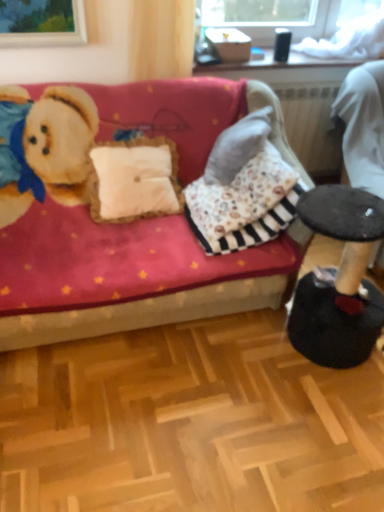
Where is `velvet red couch at center`? The image size is (384, 512). velvet red couch at center is located at coordinates (144, 312).

What do you see at coordinates (144, 312) in the screenshot? I see `velvet red couch at center` at bounding box center [144, 312].

What is the approximate height of velvet red couch at center?

velvet red couch at center is 35.06 inches tall.

Measure the distance between dark brown leather swivel chair at right and camera.

They are 2.07 meters apart.

You are a GUI agent. You are given a task and a screenshot of the screen. Output one action in this format:
    pyautogui.click(x=<x>, y=<y>)
    Task: Click on the dark brown leather swivel chair at right
    This screenshot has height=512, width=384.
    Given the screenshot: What is the action you would take?
    pyautogui.click(x=363, y=125)

What is the approximate height of dark brown leather swivel chair at right?

dark brown leather swivel chair at right is 36.82 inches in height.

The height and width of the screenshot is (512, 384). What do you see at coordinates (363, 125) in the screenshot? I see `dark brown leather swivel chair at right` at bounding box center [363, 125].

You are a GUI agent. You are given a task and a screenshot of the screen. Output one action in this format:
    pyautogui.click(x=<x>, y=<y>)
    Task: Click on the velvet red couch at center
    
    Given the screenshot: What is the action you would take?
    pyautogui.click(x=144, y=312)

Between dark brown leather swivel chair at right and velvet red couch at center, which one appears on the left side from the viewer's perspective?

Positioned to the left is velvet red couch at center.

Considering the positions of objects dark brown leather swivel chair at right and velvet red couch at center in the image provided, who is behind, dark brown leather swivel chair at right or velvet red couch at center?

Positioned behind is dark brown leather swivel chair at right.

Does point (351, 139) appear closer or farther from the camera than point (105, 333)?

Point (351, 139).

From the image's perspective, is dark brown leather swivel chair at right located above or below velvet red couch at center?

Clearly, from the image's perspective, dark brown leather swivel chair at right is above velvet red couch at center.

From a real-world perspective, which is physically above, dark brown leather swivel chair at right or velvet red couch at center?

From a 3D spatial view, dark brown leather swivel chair at right is above.

Between dark brown leather swivel chair at right and velvet red couch at center, which one has smaller width?

With smaller width is dark brown leather swivel chair at right.

Who is shorter, dark brown leather swivel chair at right or velvet red couch at center?

Standing shorter between the two is velvet red couch at center.

Does dark brown leather swivel chair at right have a larger size compared to velvet red couch at center?

Incorrect, dark brown leather swivel chair at right is not larger than velvet red couch at center.

Is dark brown leather swivel chair at right surrounding velvet red couch at center?

Actually, velvet red couch at center is outside dark brown leather swivel chair at right.

Does dark brown leather swivel chair at right touch velvet red couch at center?

No, dark brown leather swivel chair at right is not in contact with velvet red couch at center.

Looking at this image, could you tell me if dark brown leather swivel chair at right is turned towards velvet red couch at center?

No, dark brown leather swivel chair at right is not turned towards velvet red couch at center.

Looking at this image, how many degrees apart are the facing directions of dark brown leather swivel chair at right and velvet red couch at center?

7.72 degrees separate the facing orientations of dark brown leather swivel chair at right and velvet red couch at center.

Measure the distance from dark brown leather swivel chair at right to velvet red couch at center.

The distance of dark brown leather swivel chair at right from velvet red couch at center is 1.04 meters.

Locate an element on the screen. Image resolution: width=384 pixels, height=512 pixels. studio couch below the dark brown leather swivel chair at right (from the image's perspective) is located at coordinates (144, 312).

Can you confirm if velvet red couch at center is positioned to the left of dark brown leather swivel chair at right?

Correct, you'll find velvet red couch at center to the left of dark brown leather swivel chair at right.

Which object is further away from the camera, velvet red couch at center or dark brown leather swivel chair at right?

dark brown leather swivel chair at right.

Does point (108, 255) appear closer or farther from the camera than point (371, 146)?

Point (108, 255) is positioned closer to the camera compared to point (371, 146).

From the image's perspective, relative to dark brown leather swivel chair at right, is velvet red couch at center above or below?

Based on their image positions, velvet red couch at center is located beneath dark brown leather swivel chair at right.

From a real-world perspective, which is physically below, velvet red couch at center or dark brown leather swivel chair at right?

velvet red couch at center is physically lower.

Can you confirm if velvet red couch at center is thinner than dark brown leather swivel chair at right?

In fact, velvet red couch at center might be wider than dark brown leather swivel chair at right.

Considering the sizes of velvet red couch at center and dark brown leather swivel chair at right in the image, is velvet red couch at center taller or shorter than dark brown leather swivel chair at right?

velvet red couch at center is shorter than dark brown leather swivel chair at right.

Is velvet red couch at center bigger than dark brown leather swivel chair at right?

Indeed, velvet red couch at center has a larger size compared to dark brown leather swivel chair at right.

Choose the correct answer: Is velvet red couch at center inside dark brown leather swivel chair at right or outside it?

The correct answer is: outside.

Can you see velvet red couch at center touching dark brown leather swivel chair at right?

velvet red couch at center and dark brown leather swivel chair at right are clearly separated.

Does velvet red couch at center turn towards dark brown leather swivel chair at right?

No, velvet red couch at center is not aimed at dark brown leather swivel chair at right.

How many degrees apart are the facing directions of velvet red couch at center and dark brown leather swivel chair at right?

The angle between the facing direction of velvet red couch at center and the facing direction of dark brown leather swivel chair at right is 7.72 degrees.

The image size is (384, 512). Identify the location of studio couch on the left of the dark brown leather swivel chair at right. (144, 312).

Identify the location of studio couch that appears in front of the dark brown leather swivel chair at right. (144, 312).

Find the location of `swivel chair that appears on the right of velvet red couch at center`. swivel chair that appears on the right of velvet red couch at center is located at coordinates coord(363,125).